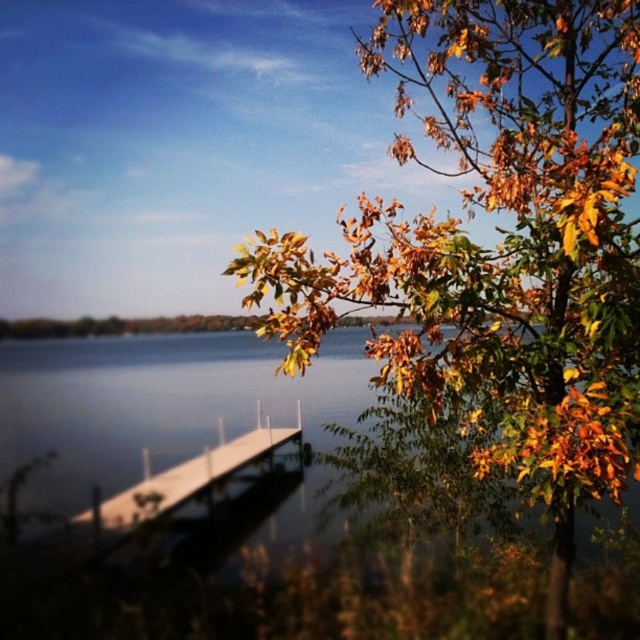
Question: Which point is closer to the camera taking this photo?

Choices:
 (A) (276, 428)
 (B) (282, 365)

Answer: (B)

Question: Which point is closer to the camera?

Choices:
 (A) (451, 28)
 (B) (112, 502)

Answer: (A)

Question: Which point appears farthest from the camera in this image?

Choices:
 (A) (348, 300)
 (B) (228, 454)

Answer: (B)

Question: Does golden leafy tree at upper right appear on the left side of white wood dock at lower center?

Choices:
 (A) no
 (B) yes

Answer: (A)

Question: Does golden leafy tree at upper right have a larger size compared to white wood dock at lower center?

Choices:
 (A) no
 (B) yes

Answer: (B)

Question: Is golden leafy tree at upper right further to the viewer compared to white wood dock at lower center?

Choices:
 (A) yes
 (B) no

Answer: (B)